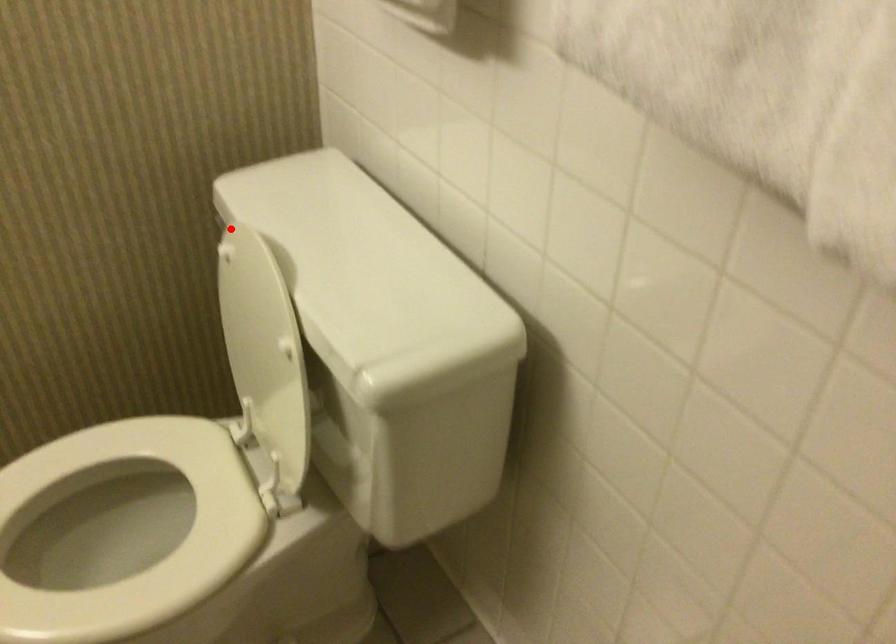
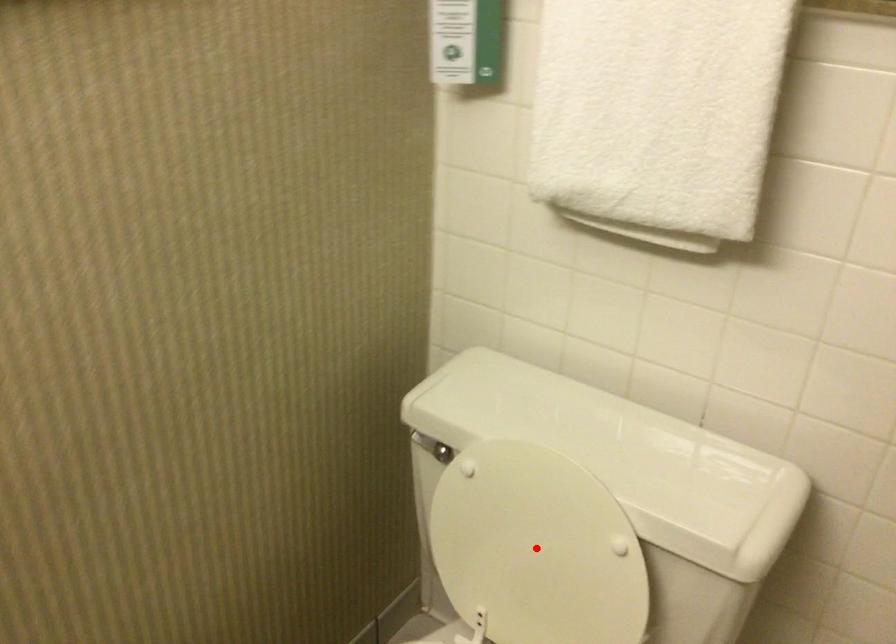
I am providing you with two images of the same scene from different viewpoints. A red point is marked on the first image and another point is marked on the second image. Are the points marked in image1 and image2 representing the same 3D position?

No